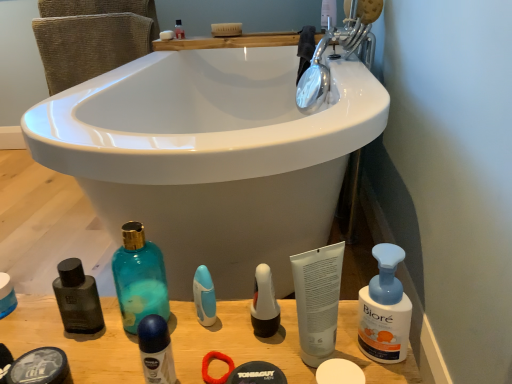
At what (x,y) coordinates should I click in order to perform the action: click on vacant space that's between white matte tube at center, positioned as the first toiletry in front-to-back order, and teal glass bottle at lower left, the first cleaning product viewed from the left. Please return your answer as a coordinate pair (x, y). The height and width of the screenshot is (384, 512). Looking at the image, I should click on (231, 334).